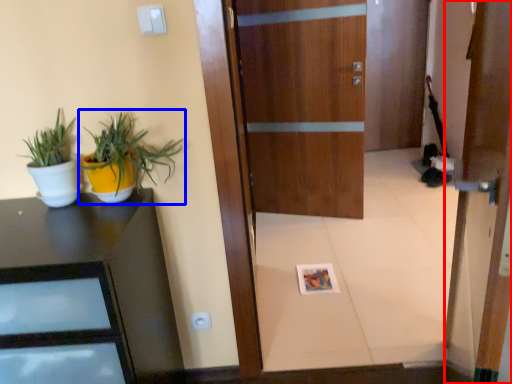
Question: Which object is further to the camera taking this photo, door (highlighted by a red box) or houseplant (highlighted by a blue box)?

Choices:
 (A) door
 (B) houseplant

Answer: (B)